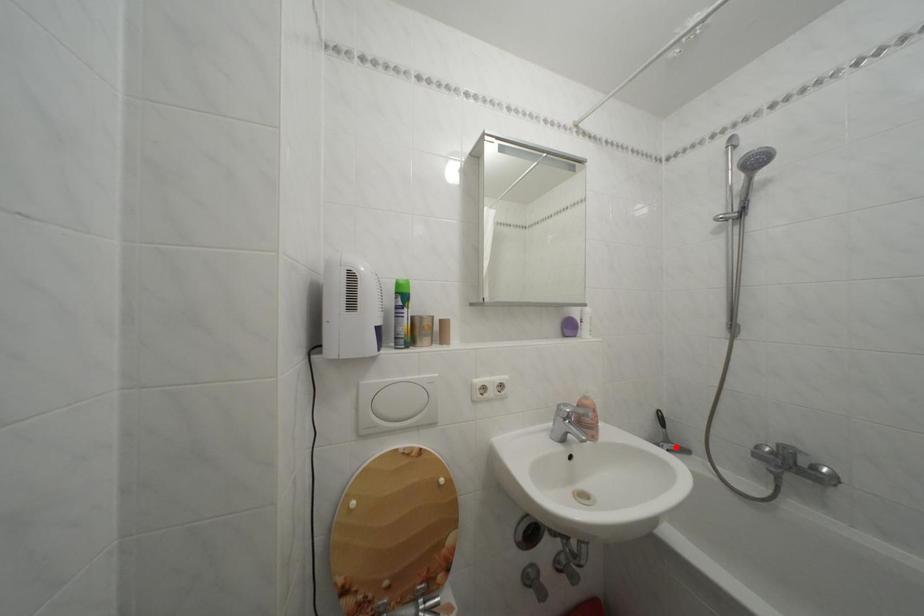
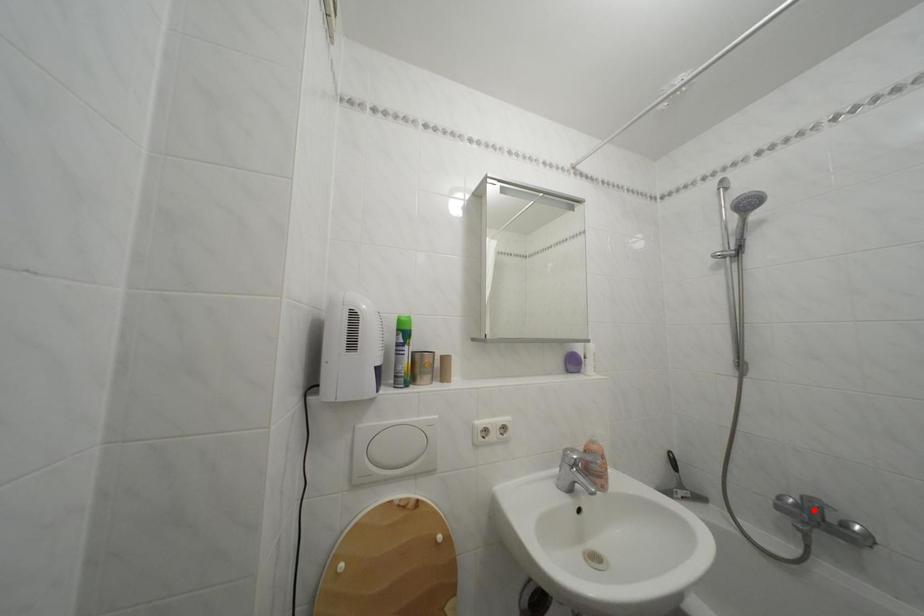
I am providing you with two images of the same scene from different viewpoints. A red point is marked on the first image and another point is marked on the second image. Are the points marked in image1 and image2 representing the same 3D position?

No